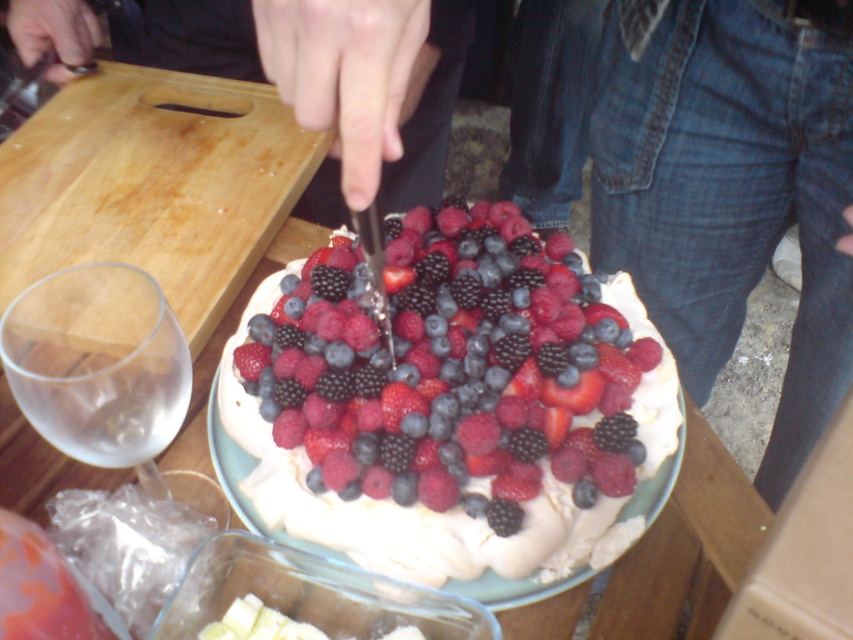
This screenshot has width=853, height=640. I want to click on white fluffy cake at center, so click(453, 406).

Image resolution: width=853 pixels, height=640 pixels. Identify the location of white fluffy cake at center. tap(453, 406).

The width and height of the screenshot is (853, 640). What do you see at coordinates (453, 406) in the screenshot?
I see `white fluffy cake at center` at bounding box center [453, 406].

Which is above, white fluffy cake at center or transparent glass at left?

Positioned higher is white fluffy cake at center.

Is point (563, 449) positioned behind point (33, 308)?

Yes, it is.

This screenshot has width=853, height=640. In order to click on white fluffy cake at center in this screenshot , I will do `click(453, 406)`.

Measure the distance between point (494, 593) and camera.

Point (494, 593) and camera are 20.32 inches apart.

Who is more distant from viewer, (558, 310) or (646, 244)?

Positioned behind is point (646, 244).

This screenshot has height=640, width=853. I want to click on white fluffy cake at center, so click(453, 406).